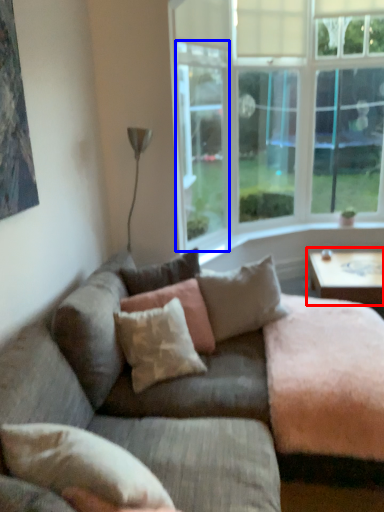
Question: Which object is closer to the camera taking this photo, coffee table (highlighted by a red box) or window screen (highlighted by a blue box)?

Choices:
 (A) coffee table
 (B) window screen

Answer: (B)